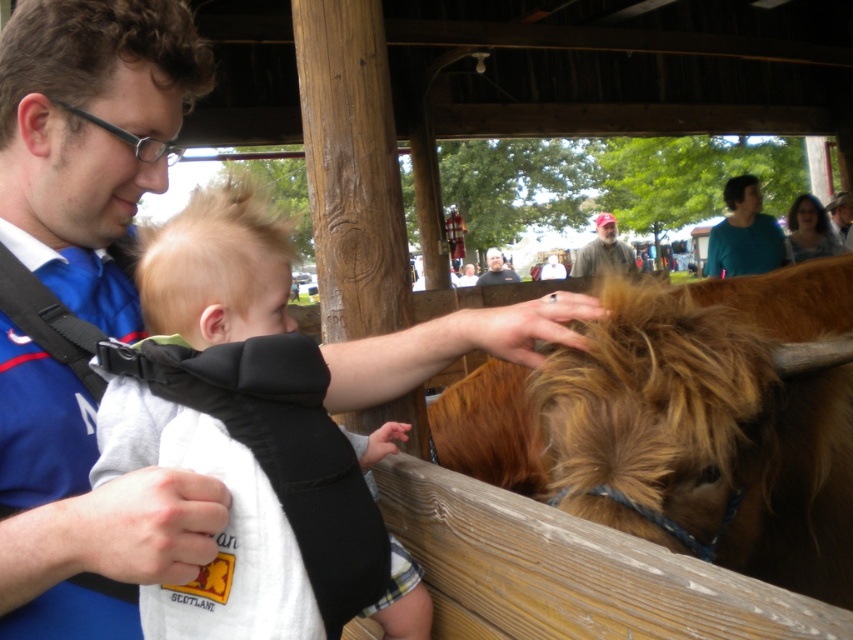
Question: Estimate the real-world distances between objects in this image. Which object is farther from the teal fabric shirt at upper right?

Choices:
 (A) brown leather hat at upper right
 (B) brown fuzzy bull at center

Answer: (B)

Question: Is teal fabric shirt at upper right above smooth brown hair at center?

Choices:
 (A) no
 (B) yes

Answer: (A)

Question: Does brown fuzzy bull at center have a greater width compared to teal fabric shirt at upper right?

Choices:
 (A) yes
 (B) no

Answer: (A)

Question: Can you confirm if brown fuzzy bull at center is positioned to the left of beige fabric cap at upper center?

Choices:
 (A) yes
 (B) no

Answer: (A)

Question: Which point appears closest to the camera in this image?

Choices:
 (A) (517, 275)
 (B) (749, 368)
 (C) (723, 192)

Answer: (B)

Question: Which object is farther from the camera taking this photo?

Choices:
 (A) beige fabric cap at upper center
 (B) light gray fabric baby carrier at center
 (C) teal fabric shirt at upper right
 (D) smooth brown hair at center

Answer: (A)